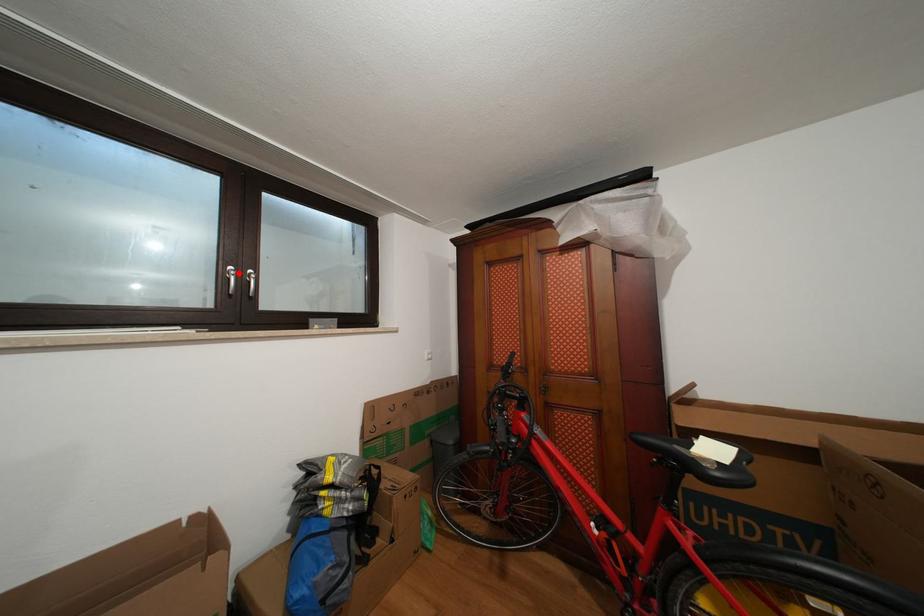
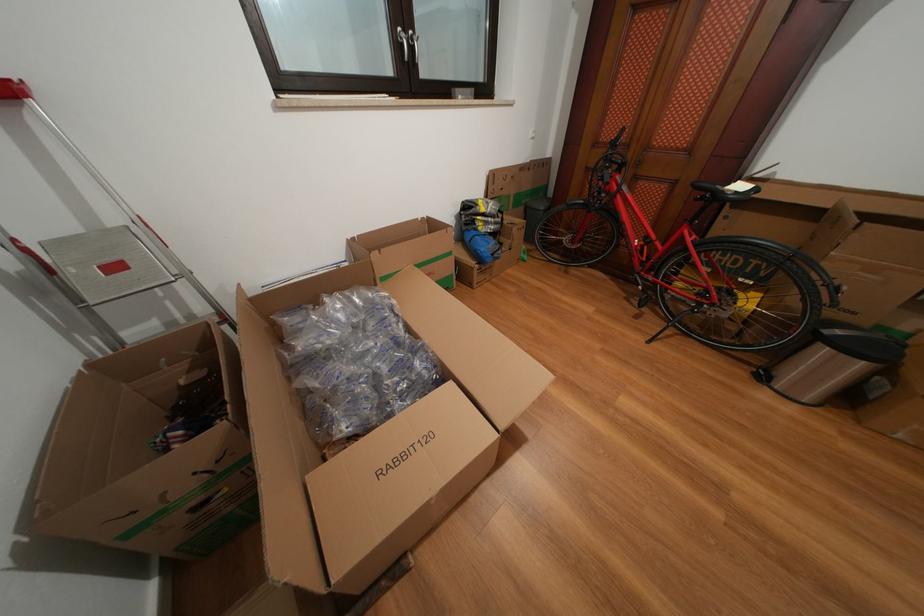
Where in the second image is the point corresponding to the highlighted location from the first image?

(407, 34)